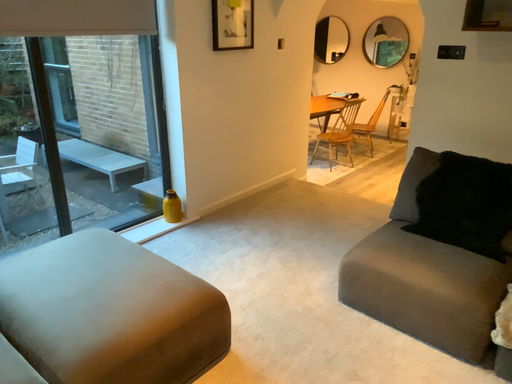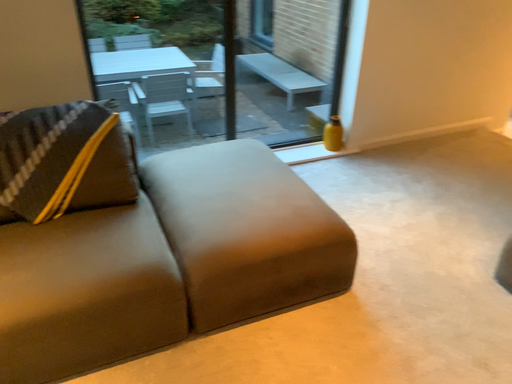
Question: Which way did the camera rotate in the video?

Choices:
 (A) rotated right
 (B) rotated left

Answer: (B)